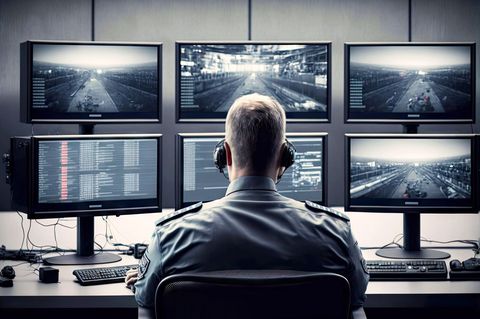
Locate an element on the screen. The height and width of the screenshot is (319, 480). computer monitors is located at coordinates (78, 84), (90, 174), (188, 163), (204, 82), (375, 83), (404, 175).